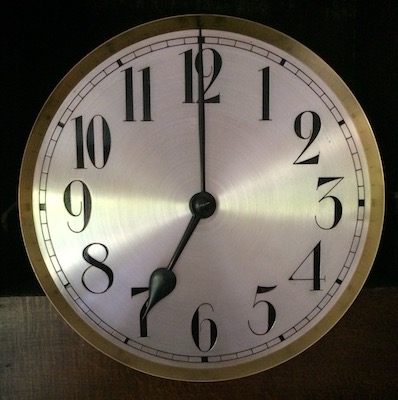
Image resolution: width=398 pixels, height=400 pixels. In order to click on thicker squares next to the 12, 3, 6, and 9 times on the clock in this screenshot , I will do `click(42, 208)`, `click(361, 201)`, `click(203, 361)`, `click(203, 39)`.